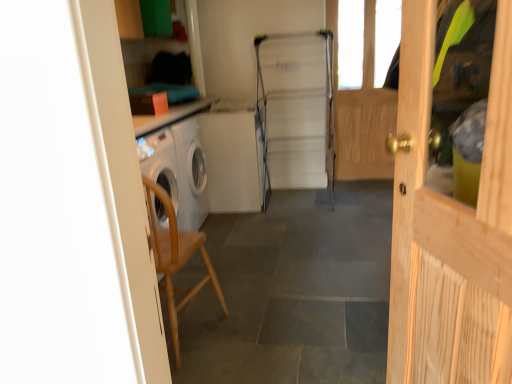
Where is `empty space that is ontop of wooden chair at left`? The width and height of the screenshot is (512, 384). empty space that is ontop of wooden chair at left is located at coordinates (293, 254).